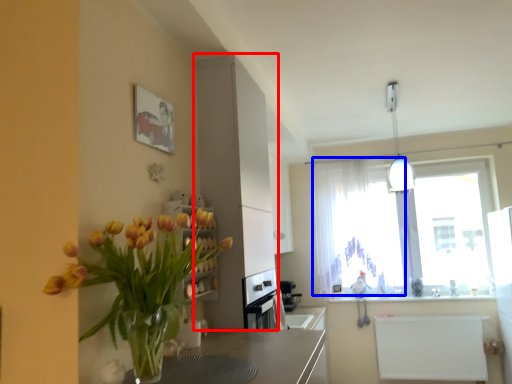
Question: Which object appears closest to the camera in this image, cabinetry (highlighted by a red box) or curtain (highlighted by a blue box)?

Choices:
 (A) cabinetry
 (B) curtain

Answer: (A)